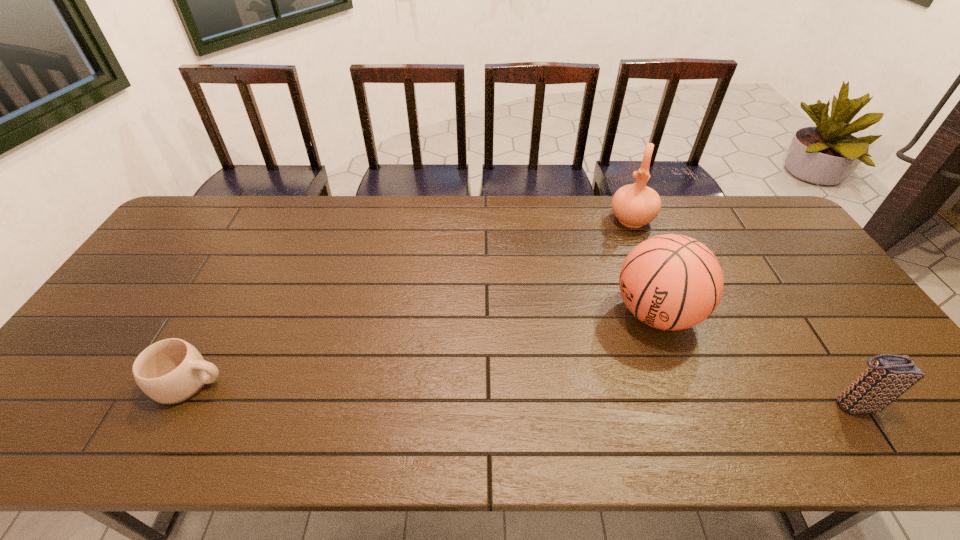
Where is `free space located on the surface of the second farthest object near the brand logo`? This screenshot has height=540, width=960. free space located on the surface of the second farthest object near the brand logo is located at coordinates (542, 396).

At what (x,y) coordinates should I click in order to perform the action: click on vacant space situated on the spout of the pottery. Please return your answer as a coordinate pair (x, y). Looking at the image, I should click on (608, 281).

At what (x,y) coordinates should I click in order to perform the action: click on vacant space located 0.110m on the spout of the pottery. Please return your answer as a coordinate pair (x, y). Looking at the image, I should click on (618, 253).

The image size is (960, 540). What are the coordinates of `vacant area situated on the spout of the pottery` in the screenshot? It's located at (621, 247).

Identify the location of object situated at the far edge. The height and width of the screenshot is (540, 960). (635, 205).

The height and width of the screenshot is (540, 960). Find the location of `mug that is at the near edge`. mug that is at the near edge is located at coordinates (171, 371).

The height and width of the screenshot is (540, 960). I want to click on clutch bag that is at the near edge, so click(x=889, y=376).

Where is `object located in the right edge section of the desktop`? The image size is (960, 540). object located in the right edge section of the desktop is located at coordinates (889, 376).

This screenshot has width=960, height=540. In order to click on object located in the near right corner section of the desktop in this screenshot , I will do `click(889, 376)`.

Where is `free space at the far edge`? This screenshot has height=540, width=960. free space at the far edge is located at coordinates (276, 239).